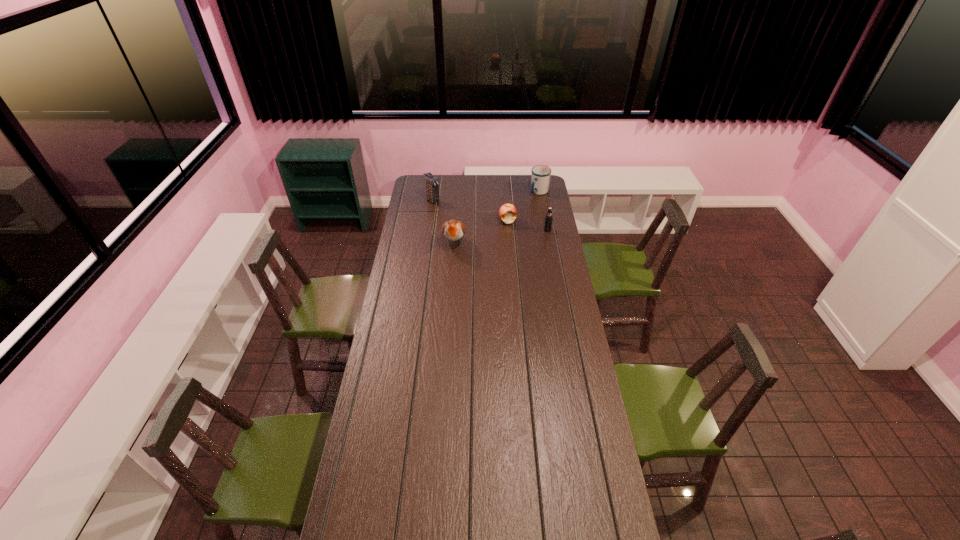
Where is `mug situated at the right edge`? mug situated at the right edge is located at coordinates (540, 177).

The image size is (960, 540). I want to click on object at the far right corner, so click(540, 177).

In the image, there is a desktop. In order to click on vacant region at the far edge in this screenshot , I will do `click(518, 182)`.

Where is `free spot at the near edge of the desktop`? Image resolution: width=960 pixels, height=540 pixels. free spot at the near edge of the desktop is located at coordinates (540, 524).

You are a GUI agent. You are given a task and a screenshot of the screen. Output one action in this format:
    pyautogui.click(x=<x>, y=<y>)
    Task: Click on the free space at the left edge of the desktop
    The image size is (960, 540).
    Given the screenshot: What is the action you would take?
    pyautogui.click(x=429, y=237)

Identify the location of free spot at the right edge of the desktop. (569, 342).

The height and width of the screenshot is (540, 960). I want to click on empty space that is in between the apple and the mug, so click(x=523, y=206).

Where is `free space that is in between the second object from left to right and the mug`? Image resolution: width=960 pixels, height=540 pixels. free space that is in between the second object from left to right and the mug is located at coordinates (497, 217).

Identify the location of free space that is in between the mug and the apple. (523, 206).

Locate an element on the screen. The image size is (960, 540). free spot between the third object from left to right and the bird is located at coordinates (481, 232).